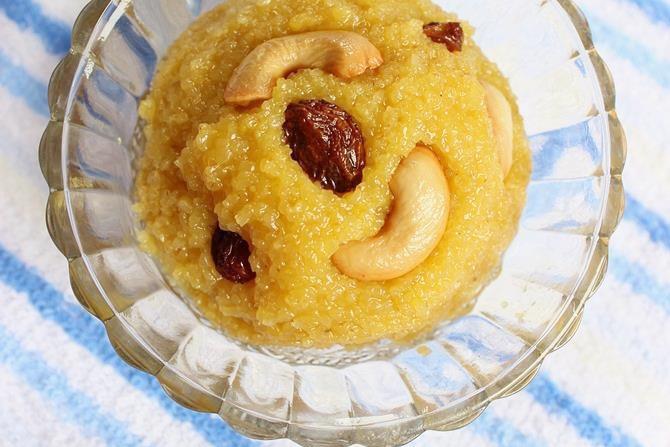
Find the location of `glass bowl`. glass bowl is located at coordinates (507, 317).